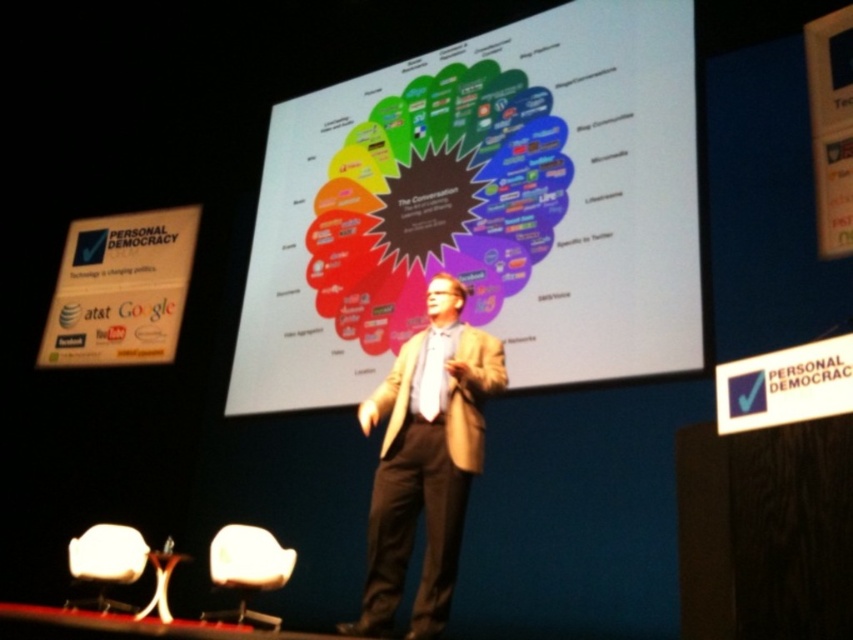
Based on the scene description, where is the white matte projection screen at center located in terms of its 2D coordinates?

The white matte projection screen at center is located at the 2D coordinates of point [485,209].

You are attending a conference and need to take a photo of the white matte projection screen at center and the white plastic chair at lower left. Which object will appear larger in your photo?

The white matte projection screen at center will appear larger in your photo because it is larger in size than the white plastic chair at lower left.